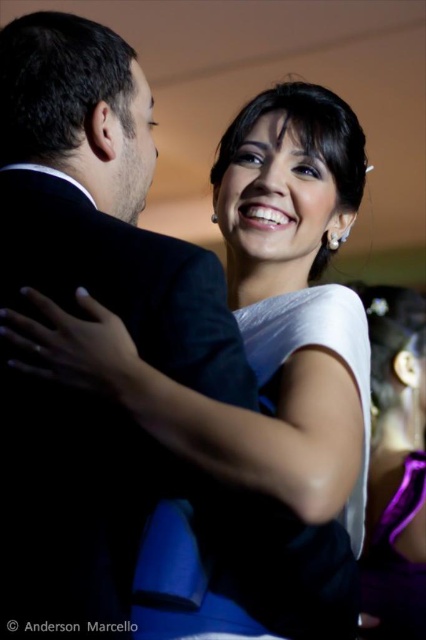
Question: Is black satin suit at center behind white satin dress at upper right?

Choices:
 (A) yes
 (B) no

Answer: (B)

Question: Which point is farther to the camera?

Choices:
 (A) (379, 604)
 (B) (412, 352)

Answer: (B)

Question: Among these points, which one is farthest from the camera?

Choices:
 (A) (373, 611)
 (B) (261, 628)
 (C) (69, 93)
 (D) (379, 540)

Answer: (D)

Question: Which of the following is the closest to the observer?

Choices:
 (A) black satin suit at center
 (B) white satin dress at center

Answer: (B)

Question: Is white satin dress at upper right wider than purple satin dress at lower right?

Choices:
 (A) no
 (B) yes

Answer: (B)

Question: Does white satin dress at center have a larger size compared to white satin dress at upper right?

Choices:
 (A) no
 (B) yes

Answer: (A)